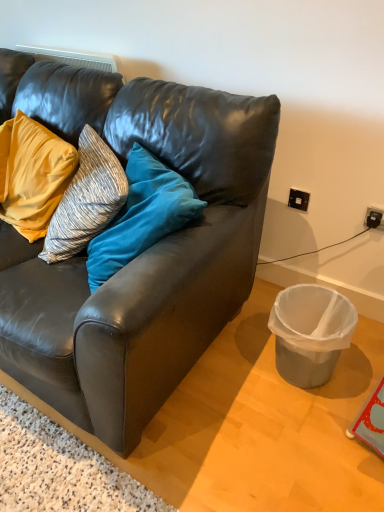
Find the location of a particular element. This screenshot has height=512, width=384. vacant space underneath metallic gray trash can at lower right (from a real-world perspective) is located at coordinates (325, 380).